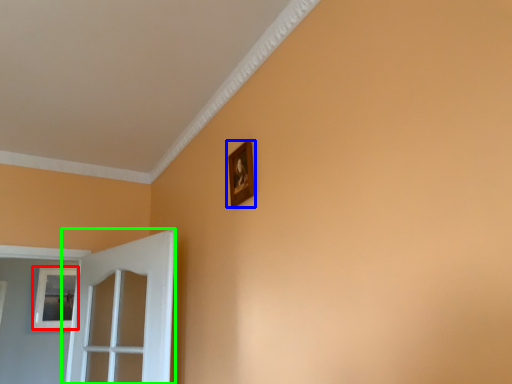
Question: Which object is the closest to the picture frame (highlighted by a red box)? Choose among these: picture frame (highlighted by a blue box) or door (highlighted by a green box).

Choices:
 (A) picture frame
 (B) door

Answer: (B)